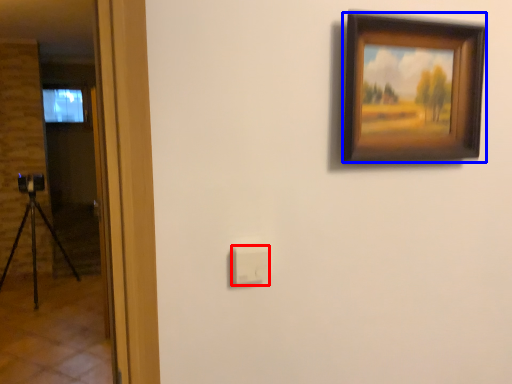
Question: Among these objects, which one is nearest to the camera, light switch (highlighted by a red box) or picture frame (highlighted by a blue box)?

Choices:
 (A) light switch
 (B) picture frame

Answer: (B)